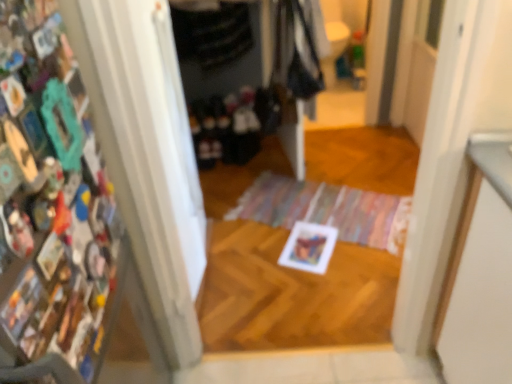
Question: Is multicolored collage at left touching dark gray fabric at upper center, the first clothing viewed from the top?

Choices:
 (A) no
 (B) yes

Answer: (A)

Question: Considering the relative sizes of multicolored collage at left and dark gray fabric at upper center, the first clothing viewed from the top, in the image provided, is multicolored collage at left thinner than dark gray fabric at upper center, the first clothing viewed from the top,?

Choices:
 (A) no
 (B) yes

Answer: (B)

Question: Can you confirm if multicolored collage at left is positioned to the right of dark gray fabric at upper center, the first clothing viewed from the top?

Choices:
 (A) yes
 (B) no

Answer: (B)

Question: Is multicolored collage at left turned away from dark gray fabric at upper center, the 2th clothing ordered from the bottom?

Choices:
 (A) no
 (B) yes

Answer: (A)

Question: From the image's perspective, is multicolored collage at left above dark gray fabric at upper center, the 2th clothing ordered from the bottom?

Choices:
 (A) yes
 (B) no

Answer: (B)

Question: Would you say multicolored woven mat at center is to the left or to the right of dark gray fabric at upper center, the 2th clothing ordered from the bottom, in the picture?

Choices:
 (A) left
 (B) right

Answer: (B)

Question: Is point (380, 215) positioned closer to the camera than point (216, 13)?

Choices:
 (A) closer
 (B) farther

Answer: (A)

Question: Choose the correct answer: Is multicolored woven mat at center inside dark gray fabric at upper center, the first clothing viewed from the top, or outside it?

Choices:
 (A) outside
 (B) inside

Answer: (A)

Question: Considering their positions, is multicolored woven mat at center located in front of or behind dark gray fabric at upper center, the 2th clothing ordered from the bottom?

Choices:
 (A) front
 (B) behind

Answer: (A)

Question: Considering the positions of point pyautogui.click(x=18, y=84) and point pyautogui.click(x=243, y=34), is point pyautogui.click(x=18, y=84) closer or farther from the camera than point pyautogui.click(x=243, y=34)?

Choices:
 (A) closer
 (B) farther

Answer: (A)

Question: From a real-world perspective, is multicolored collage at left positioned above or below dark gray fabric at upper center, the 2th clothing ordered from the bottom?

Choices:
 (A) above
 (B) below

Answer: (A)

Question: Is multicolored collage at left situated inside dark gray fabric at upper center, the 2th clothing ordered from the bottom, or outside?

Choices:
 (A) outside
 (B) inside

Answer: (A)

Question: In the image, is multicolored collage at left on the left side or the right side of dark gray fabric at upper center, the first clothing viewed from the top?

Choices:
 (A) left
 (B) right

Answer: (A)

Question: Is dark fabric clothes at center, which ranks as the 2th clothing in top-to-bottom order, inside the boundaries of multicolored woven mat at center, or outside?

Choices:
 (A) inside
 (B) outside

Answer: (B)

Question: Considering the positions of dark fabric clothes at center, which ranks as the 2th clothing in top-to-bottom order, and multicolored woven mat at center in the image, is dark fabric clothes at center, which ranks as the 2th clothing in top-to-bottom order, taller or shorter than multicolored woven mat at center?

Choices:
 (A) short
 (B) tall

Answer: (B)